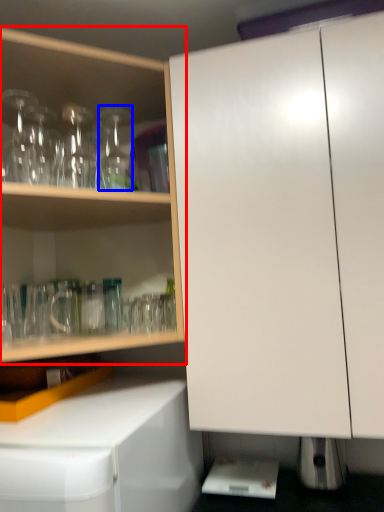
Question: Which object is further to the camera taking this photo, cabinetry (highlighted by a red box) or bottle (highlighted by a blue box)?

Choices:
 (A) cabinetry
 (B) bottle

Answer: (B)